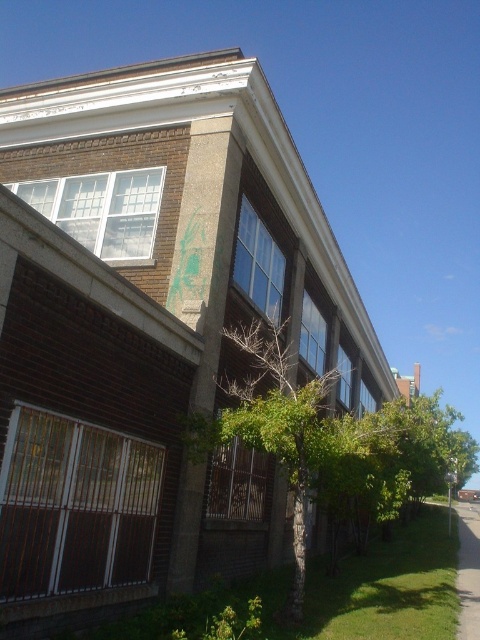
Question: Which point appears closest to the camera in this image?

Choices:
 (A) (327, 452)
 (B) (472, 609)

Answer: (A)

Question: Does green leafy tree at center come behind green grass at lower right?

Choices:
 (A) no
 (B) yes

Answer: (A)

Question: Can you confirm if green leafy tree at center is thinner than green grass at lower right?

Choices:
 (A) no
 (B) yes

Answer: (A)

Question: Which point is closer to the camera?

Choices:
 (A) (311, 384)
 (B) (479, 547)

Answer: (A)

Question: Does green leafy tree at center have a greater width compared to green grass at lower right?

Choices:
 (A) no
 (B) yes

Answer: (B)